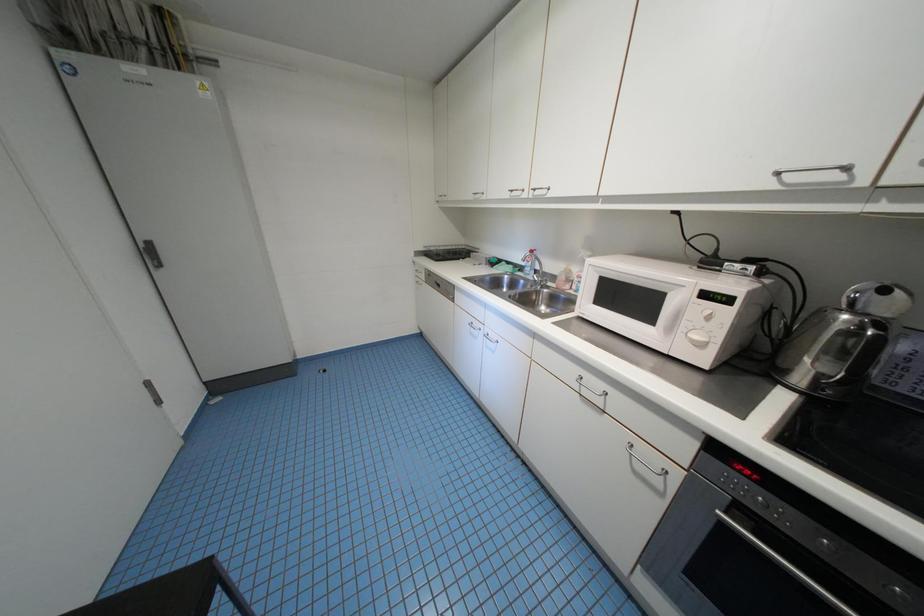
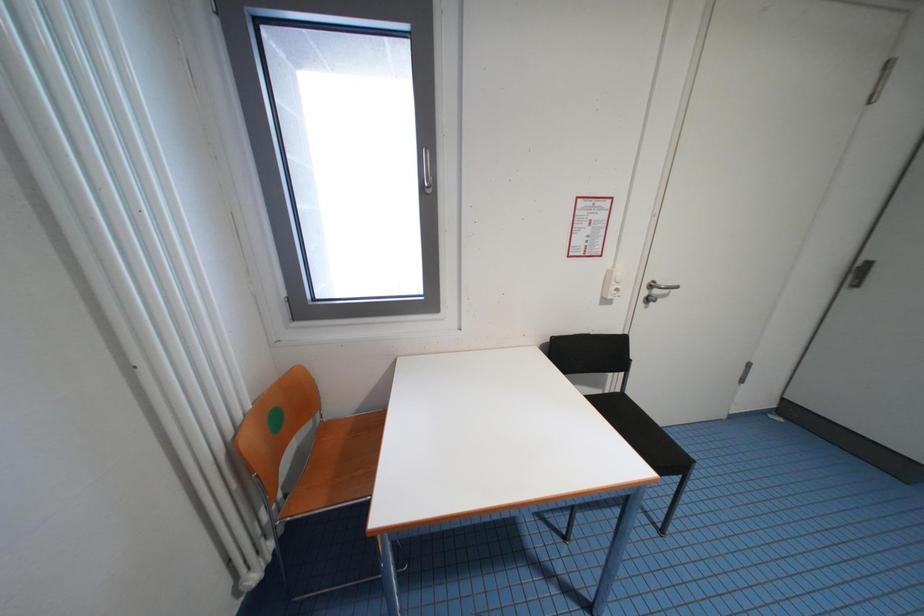
The first image is from the beginning of the video and the second image is from the end. How did the camera likely rotate when shooting the video?

The camera's rotation is toward left-down.